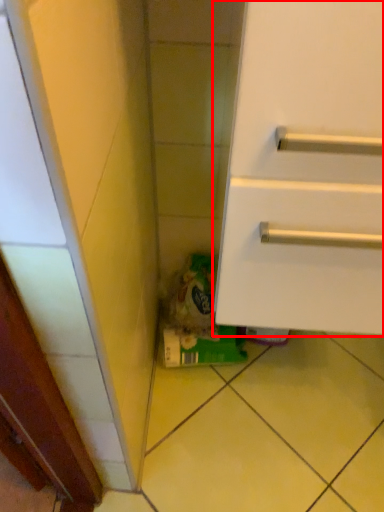
Question: From the image's perspective, considering the relative positions of cabinetry (annotated by the red box) and garbage in the image provided, where is cabinetry (annotated by the red box) located with respect to the staircase?

Choices:
 (A) above
 (B) below

Answer: (A)